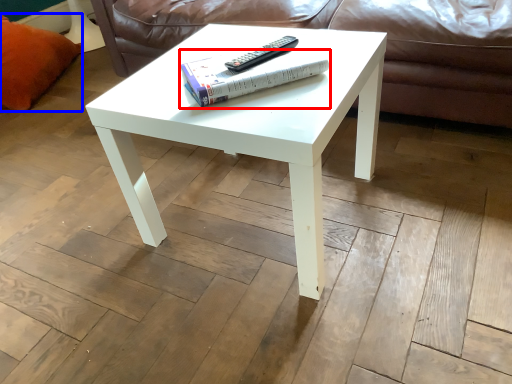
Question: Which object appears farthest to the camera in this image, paperback book (highlighted by a red box) or pillow (highlighted by a blue box)?

Choices:
 (A) paperback book
 (B) pillow

Answer: (B)